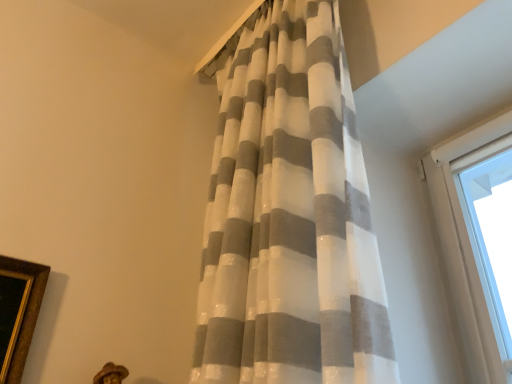
Identify the location of gold wooden picture frame at lower left. The height and width of the screenshot is (384, 512). (21, 313).

What do you see at coordinates (21, 313) in the screenshot? I see `gold wooden picture frame at lower left` at bounding box center [21, 313].

I want to click on gold wooden picture frame at lower left, so click(21, 313).